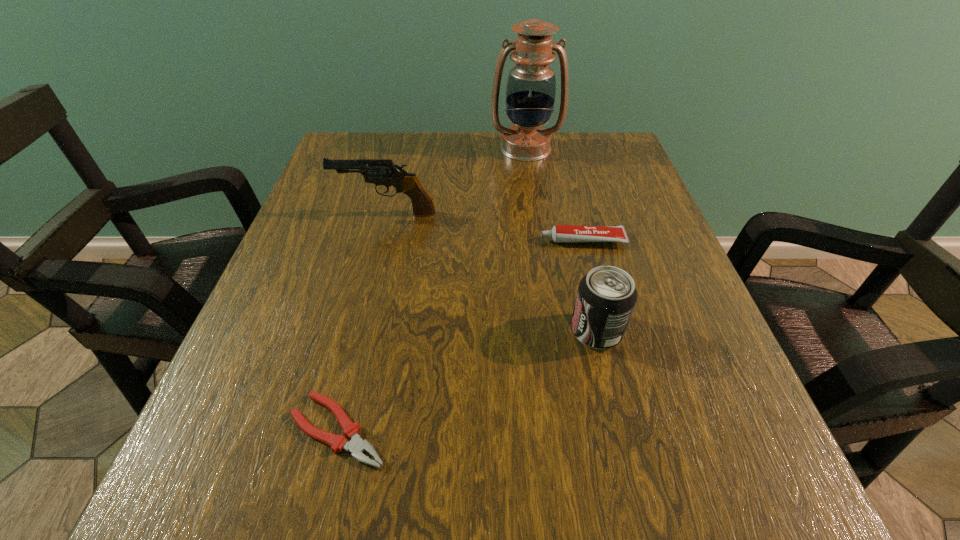
Locate an element on the screen. The image size is (960, 540). soda can at the right edge is located at coordinates (606, 296).

Find the location of a particular element. The image size is (960, 540). toothpaste present at the right edge is located at coordinates (560, 233).

This screenshot has height=540, width=960. I want to click on object that is at the near left corner, so click(356, 446).

Locate an element on the screen. The height and width of the screenshot is (540, 960). object situated at the far right corner is located at coordinates (531, 85).

This screenshot has height=540, width=960. Find the location of `vacant space at the far edge`. vacant space at the far edge is located at coordinates (463, 177).

In the image, there is a desktop. Identify the location of vacant space at the left edge. This screenshot has height=540, width=960. (248, 381).

At what (x,y) coordinates should I click in order to perform the action: click on free region at the right edge of the desktop. Please return your answer as a coordinate pair (x, y). Looking at the image, I should click on (726, 373).

You are a GUI agent. You are given a task and a screenshot of the screen. Output one action in this format:
    pyautogui.click(x=<x>, y=<y>)
    Task: Click on the free region at the far left corner
    This screenshot has height=540, width=960.
    Given the screenshot: What is the action you would take?
    pyautogui.click(x=357, y=143)

Where is `free space at the near left corner of the desktop`? free space at the near left corner of the desktop is located at coordinates (223, 533).

Where is `free space at the far right corner`? free space at the far right corner is located at coordinates (595, 147).